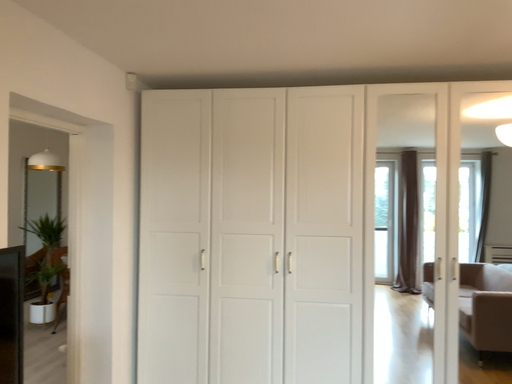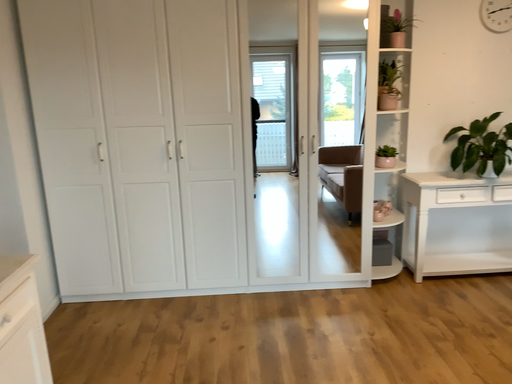
Question: How did the camera likely rotate when shooting the video?

Choices:
 (A) rotated right
 (B) rotated left

Answer: (A)